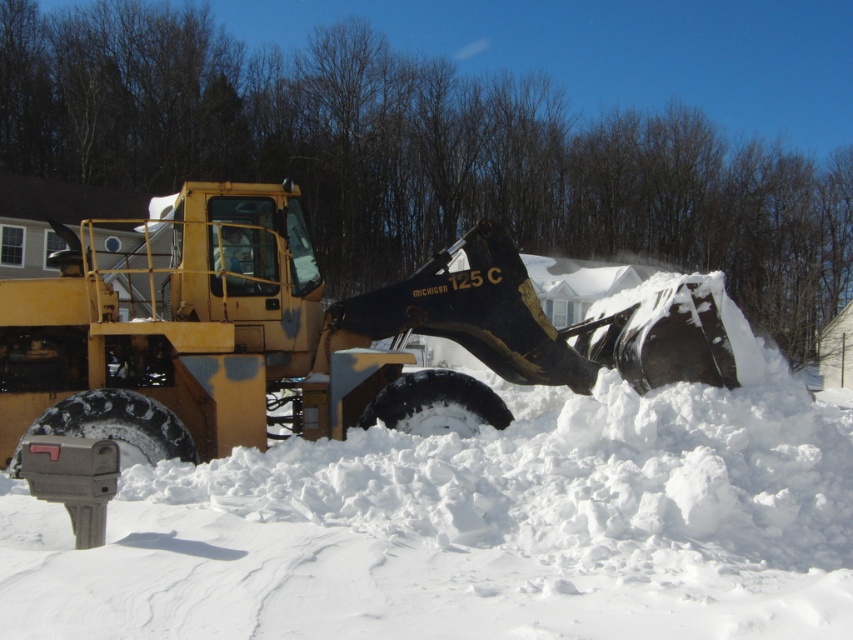
Question: Which point is closer to the camera?

Choices:
 (A) yellow metallic tractor at center
 (B) white fluffy snow at center

Answer: (B)

Question: Where is white fluffy snow at center located in relation to yellow metallic tractor at center in the image?

Choices:
 (A) above
 (B) below

Answer: (B)

Question: Can you confirm if white fluffy snow at center is positioned below yellow metallic tractor at center?

Choices:
 (A) no
 (B) yes

Answer: (B)

Question: Among these objects, which one is nearest to the camera?

Choices:
 (A) yellow metallic tractor at center
 (B) white fluffy snow at center

Answer: (B)

Question: Is white fluffy snow at center smaller than yellow metallic tractor at center?

Choices:
 (A) no
 (B) yes

Answer: (B)

Question: Among these objects, which one is nearest to the camera?

Choices:
 (A) yellow metallic tractor at center
 (B) white fluffy snow at center

Answer: (B)